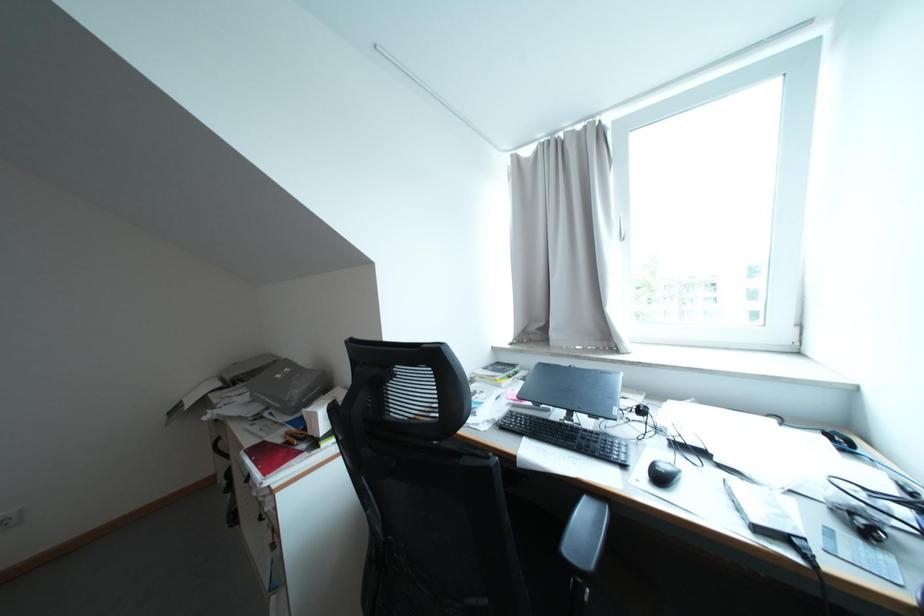
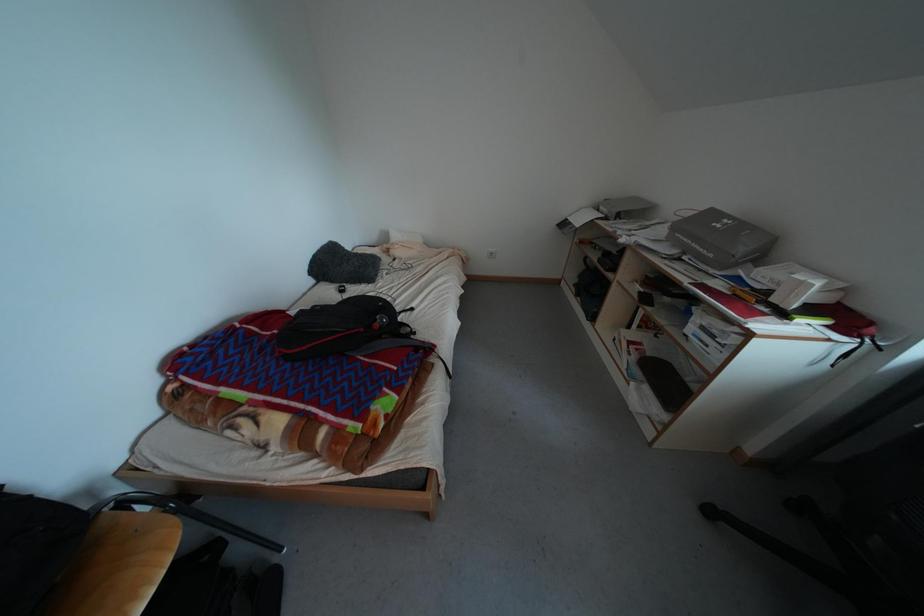
Based on the continuous images, in which direction is the camera rotating?

The rotation direction of the camera is left-down.